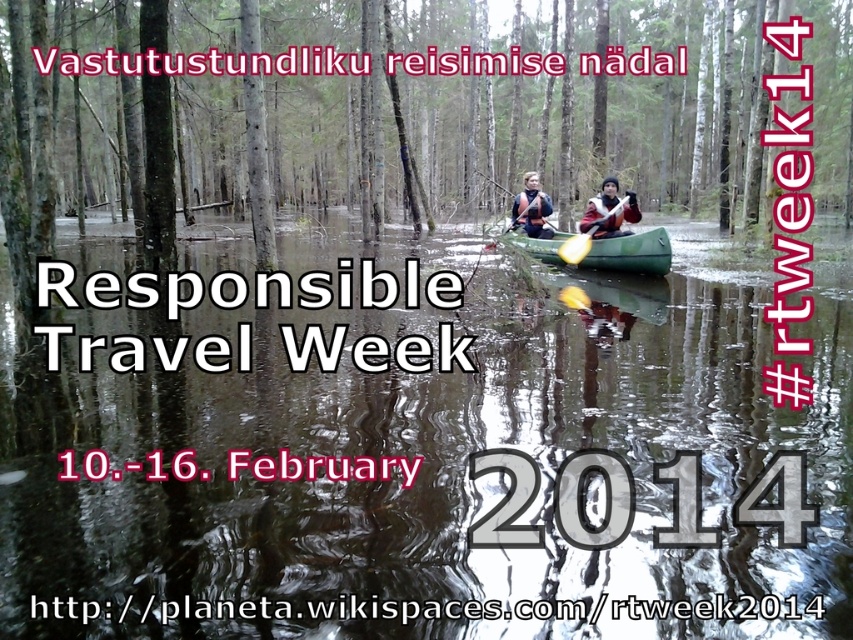
Question: Which object is the farthest from the clear water at center?

Choices:
 (A) matte black kayak at center
 (B) yellow plastic paddle at center

Answer: (A)

Question: Can you confirm if yellow foam paddle at center is smaller than yellow plastic paddle at center?

Choices:
 (A) yes
 (B) no

Answer: (A)

Question: Which point appears closest to the camera in this image?

Choices:
 (A) (511, 225)
 (B) (596, 234)
 (C) (599, 205)
 (D) (444, 529)

Answer: (D)

Question: In this image, where is green rubber canoe at center located relative to yellow plastic paddle at center?

Choices:
 (A) left
 (B) right

Answer: (B)

Question: Which of the following is the closest to the observer?

Choices:
 (A) (527, 230)
 (B) (622, 241)
 (C) (280, 595)
 (D) (589, 224)

Answer: (C)

Question: Does clear water at center appear over matte black kayak at center?

Choices:
 (A) no
 (B) yes

Answer: (A)